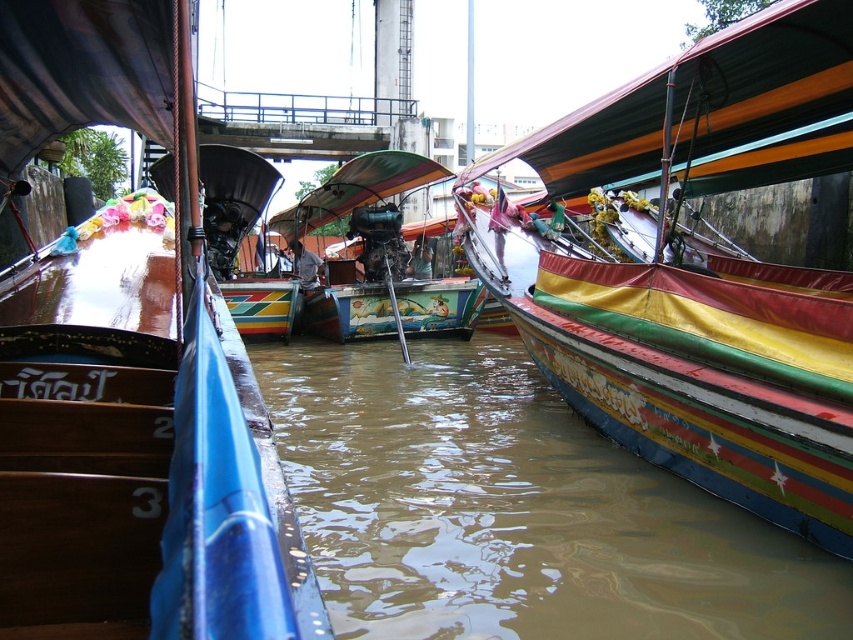
Does brown murky water at center have a larger size compared to multicolored painted boat at center?

Correct, brown murky water at center is larger in size than multicolored painted boat at center.

Between point (795, 600) and point (605, 272), which one is positioned in front?

Point (795, 600) is in front.

This screenshot has width=853, height=640. In order to click on brown murky water at center in this screenshot , I will do `click(514, 509)`.

Is brown murky water at center positioned behind wooden boat at left?

Yes, brown murky water at center is behind wooden boat at left.

Does point (350, 360) come in front of point (171, 305)?

No, (350, 360) is further to viewer.

Which is behind, point (305, 339) or point (74, 28)?

Point (305, 339)

The image size is (853, 640). I want to click on brown murky water at center, so click(514, 509).

Is multicolored painted boat at center wider than painted wooden boat at center?

Incorrect, multicolored painted boat at center's width does not surpass painted wooden boat at center's.

Is multicolored painted boat at center smaller than painted wooden boat at center?

Yes, multicolored painted boat at center is smaller than painted wooden boat at center.

Is point (682, 413) behind point (386, 243)?

No, (682, 413) is closer to viewer.

Locate an element on the screen. The height and width of the screenshot is (640, 853). multicolored painted boat at center is located at coordinates (700, 275).